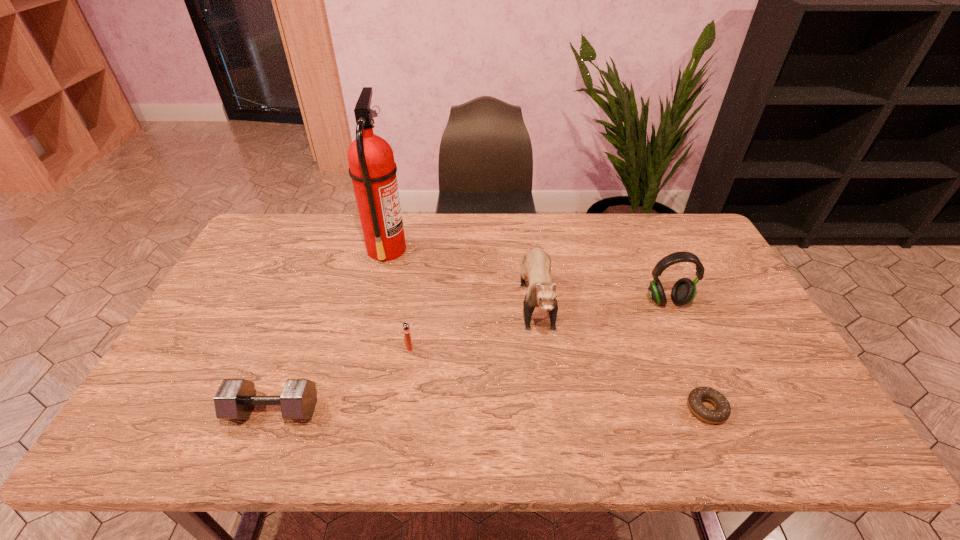
What are the coordinates of `free region located on the right of the leftmost object` in the screenshot? It's located at (433, 410).

You are a GUI agent. You are given a task and a screenshot of the screen. Output one action in this format:
    pyautogui.click(x=<x>, y=<y>)
    Task: Click on the free space located 0.090m on the back of the third object from left to right
    The height and width of the screenshot is (540, 960).
    Given the screenshot: What is the action you would take?
    pyautogui.click(x=414, y=318)

Locate an element on the screen. The width and height of the screenshot is (960, 540). vacant space positioned 0.090m on the right of the shortest object is located at coordinates (764, 409).

Find the location of a particular element. The image size is (960, 540). fire extinguisher that is at the far edge is located at coordinates (372, 168).

At what (x,y) coordinates should I click in order to perform the action: click on ferret located at the far edge. Please return your answer as a coordinate pair (x, y). Looking at the image, I should click on (536, 265).

The width and height of the screenshot is (960, 540). What are the coordinates of `dumbbell that is at the near edge` in the screenshot? It's located at (235, 399).

Where is `doughnut at the near edge`? doughnut at the near edge is located at coordinates (722, 412).

In the image, there is a desktop. Identify the location of vacant space at the far edge. (641, 230).

At what (x,y) coordinates should I click in order to perform the action: click on free space at the near edge of the desktop. Please return your answer as a coordinate pair (x, y). Looking at the image, I should click on (545, 431).

You are a GUI agent. You are given a task and a screenshot of the screen. Output one action in this format:
    pyautogui.click(x=<x>, y=<y>)
    Task: Click on the vacant space at the right edge of the desktop
    Image resolution: width=960 pixels, height=540 pixels.
    Given the screenshot: What is the action you would take?
    pyautogui.click(x=755, y=414)